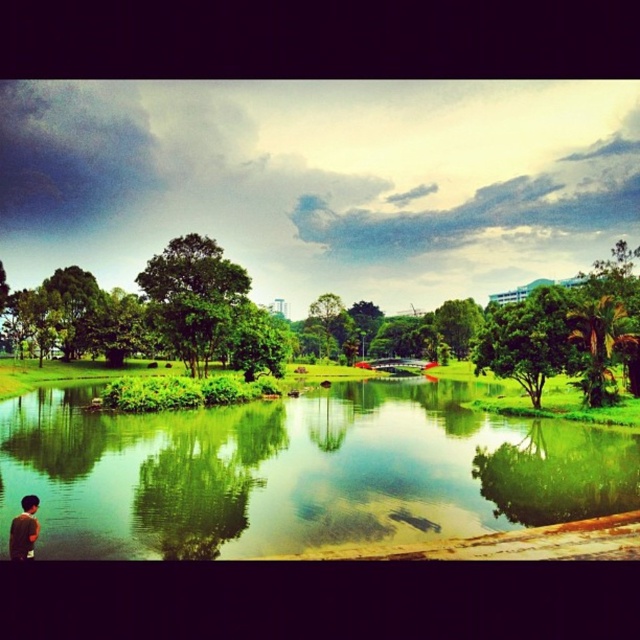
Question: Does green reflective water at lower left have a larger size compared to green matte shirt at lower left?

Choices:
 (A) yes
 (B) no

Answer: (A)

Question: Which point is farther to the camera?

Choices:
 (A) (352, 493)
 (B) (177, 337)
 (C) (0, 262)

Answer: (C)

Question: Does green leafy tree at center lie in front of green matte shirt at lower left?

Choices:
 (A) no
 (B) yes

Answer: (A)

Question: Which point appears farthest from the camera in this image?

Choices:
 (A) (1, 310)
 (B) (161, 472)
 (C) (20, 529)

Answer: (A)

Question: Which object is farther from the camera taking this photo?

Choices:
 (A) green reflective water at lower left
 (B) green leafy tree at left
 (C) green leafy tree at center
 (D) green matte shirt at lower left

Answer: (B)

Question: Does green leafy tree at center appear under green matte shirt at lower left?

Choices:
 (A) no
 (B) yes

Answer: (A)